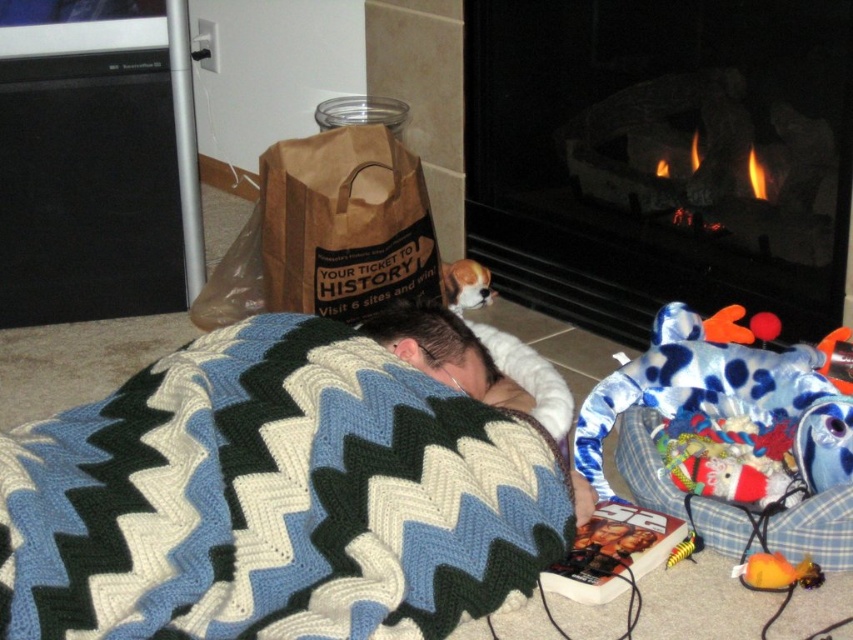
Looking at this image, you are a delivery person who just placed a brown paper bag at center on the floor. Now you need to cover it with the knitted wool blanket at center. Is the blanket tall enough to cover the bag?

The brown paper bag at center has a greater height compared to knitted wool blanket at center, so the blanket is not tall enough to fully cover the bag.

You are a delivery person who just arrived at the house. You need to place a new package on the floor in the area where the brown paper bag at center and the brown fur dog at upper center are located. Where should you place the package so it doesn not block the view of the dog?

Place the package in front of the brown paper bag at center since it is already in front of the brown fur dog at upper center, ensuring the dog remains visible.

You are a delivery robot that needs to deliver a package to the point at point [363,616]. You are currently at the person lying on the floor. Can you reach the delivery point without moving the knitted blanket with a zigzag pattern in shades of blue, white, and green?

The distance between the person lying on the floor and the point at point [363,616] is 1.03 meters. Since the robot can move freely around the blanket if there is enough space, but the question specifies not moving the blanket, it depends on the blanket coverage. However, the given information only states their distance apart, not the blanket size. Thus, insufficient data to confirm if the path is clear without disturbing the blanket.